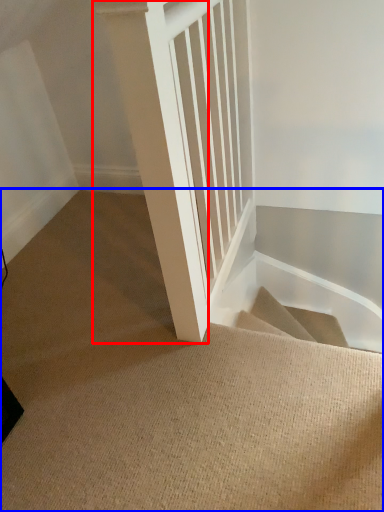
Question: Which object is further to the camera taking this photo, pillar (highlighted by a red box) or stairs (highlighted by a blue box)?

Choices:
 (A) pillar
 (B) stairs

Answer: (B)